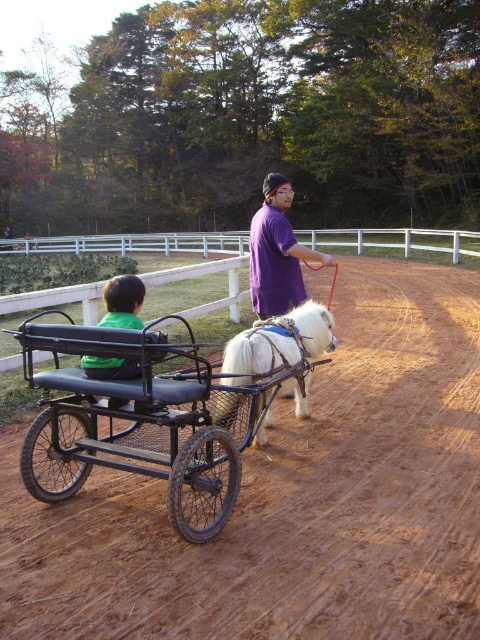
Question: Estimate the real-world distances between objects in this image. Which object is farther from the brown dirt field at center?

Choices:
 (A) purple matte shirt at center
 (B) white soft fur horse at center
 (C) green matte shirt at center

Answer: (C)

Question: Does white soft fur horse at center have a lesser width compared to green matte shirt at center?

Choices:
 (A) yes
 (B) no

Answer: (B)

Question: Observing the image, what is the correct spatial positioning of brown dirt field at center in reference to green matte shirt at center?

Choices:
 (A) below
 (B) above

Answer: (A)

Question: Does black rubber wagon at center come in front of purple matte shirt at center?

Choices:
 (A) no
 (B) yes

Answer: (B)

Question: Which of these objects is positioned closest to the black rubber wagon at center?

Choices:
 (A) purple matte shirt at center
 (B) brown dirt field at center
 (C) white soft fur horse at center

Answer: (C)

Question: Which of these objects is positioned closest to the green matte shirt at center?

Choices:
 (A) purple matte shirt at center
 (B) black rubber wagon at center
 (C) brown dirt field at center
 (D) white soft fur horse at center

Answer: (B)